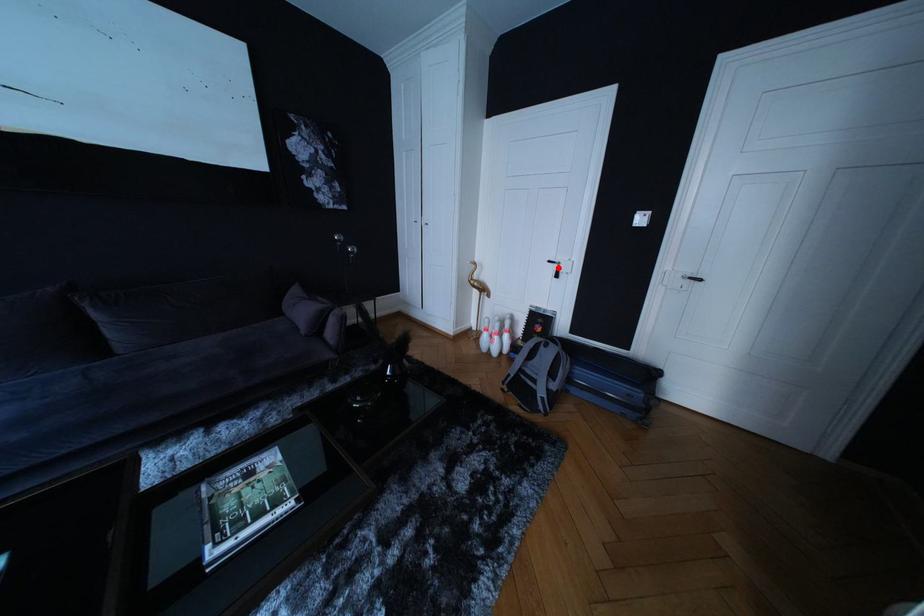
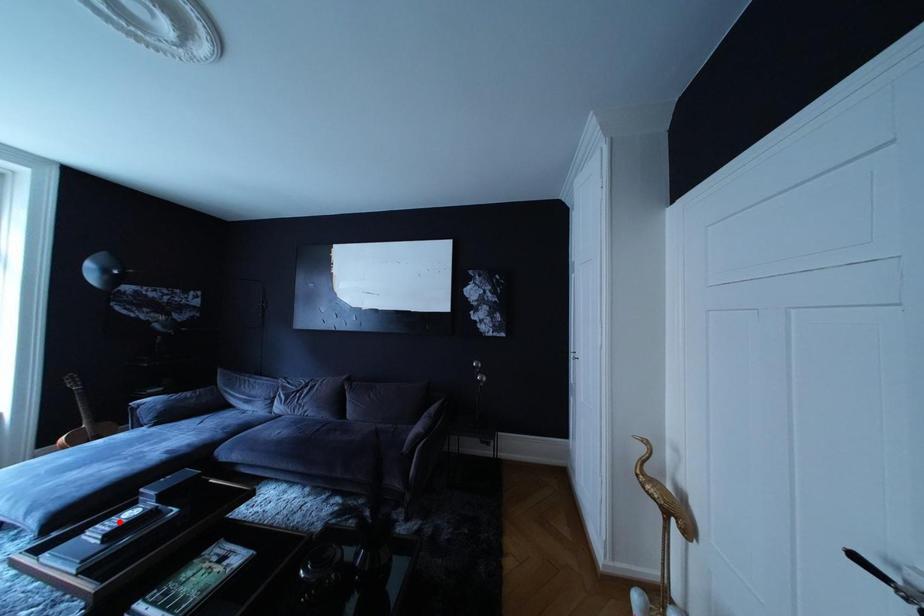
I am providing you with two images of the same scene from different viewpoints. A red point is marked on the first image and another point is marked on the second image. Is the marked point in image1 the same physical position as the marked point in image2?

No